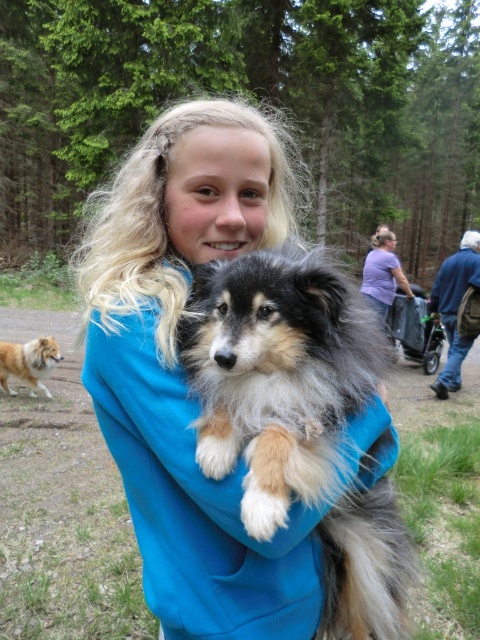
Does blue soft sweater at center appear on the right side of fluffy fur dog at center?

No, blue soft sweater at center is not to the right of fluffy fur dog at center.

Is point (172, 560) positioned before point (269, 314)?

That is False.

Where is `blue soft sweater at center`? This screenshot has width=480, height=640. blue soft sweater at center is located at coordinates (182, 374).

Is fluffy fur dog at center thinner than brown fluffy dog at left?

Correct, fluffy fur dog at center's width is less than brown fluffy dog at left's.

Is point (241, 515) less distant than point (22, 369)?

Yes.

You are a GUI agent. You are given a task and a screenshot of the screen. Output one action in this format:
    pyautogui.click(x=<x>, y=<y>)
    Task: Click on the fluffy fur dog at center
    This screenshot has height=640, width=480.
    Given the screenshot: What is the action you would take?
    pyautogui.click(x=276, y=372)

Between blue soft sweater at center and brown fluffy dog at left, which one is positioned higher?

blue soft sweater at center is higher up.

Does point (118, 308) come closer to viewer compared to point (32, 369)?

Yes, it is in front of point (32, 369).

The width and height of the screenshot is (480, 640). Find the location of `blue soft sweater at center`. blue soft sweater at center is located at coordinates (182, 374).